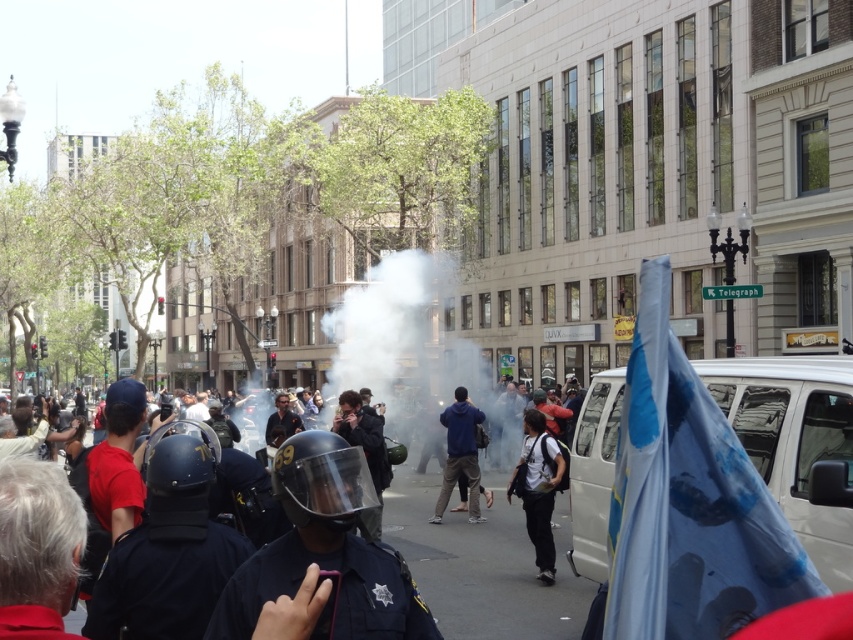
You are an observer standing at the edge of the scene. You notice the matte black helmet at center and the white matte backpack at center. Which object is wider?

The matte black helmet at center is wider than the white matte backpack at center according to the description.

You are a photographer standing at the camera position. You want to take a photo of both the point at coordinates point (x=378, y=637) and point (x=531, y=440). Which point will appear larger in your photo?

Point (x=378, y=637) is closer to the camera than point (x=531, y=440), so it will appear larger in the photo.